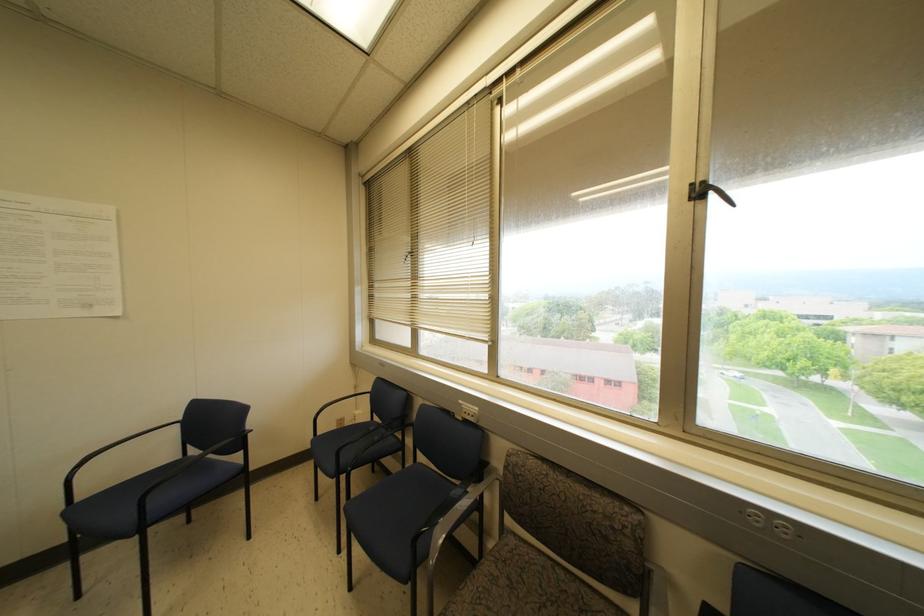
The width and height of the screenshot is (924, 616). What do you see at coordinates (199, 472) in the screenshot? I see `the metal chair armrest` at bounding box center [199, 472].